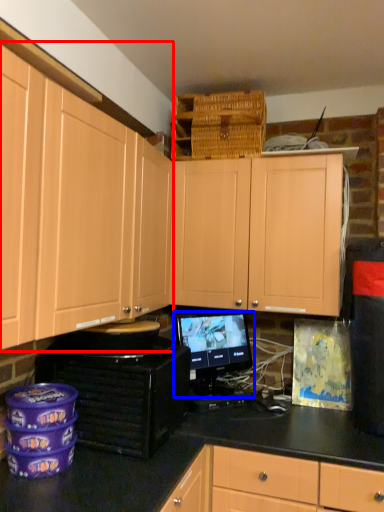
Question: Which of the following is the farthest to the observer, cabinetry (highlighted by a red box) or computer monitor (highlighted by a blue box)?

Choices:
 (A) cabinetry
 (B) computer monitor

Answer: (B)